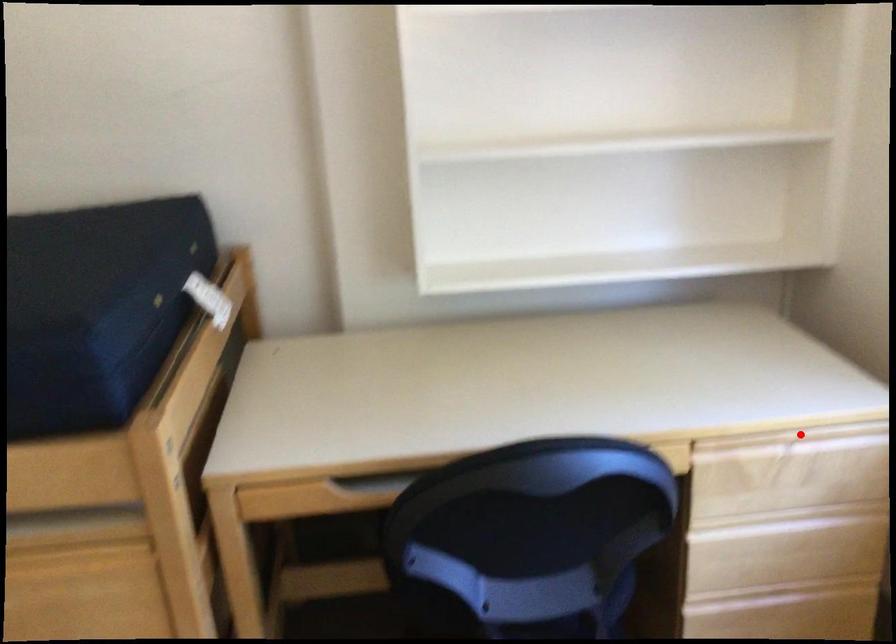
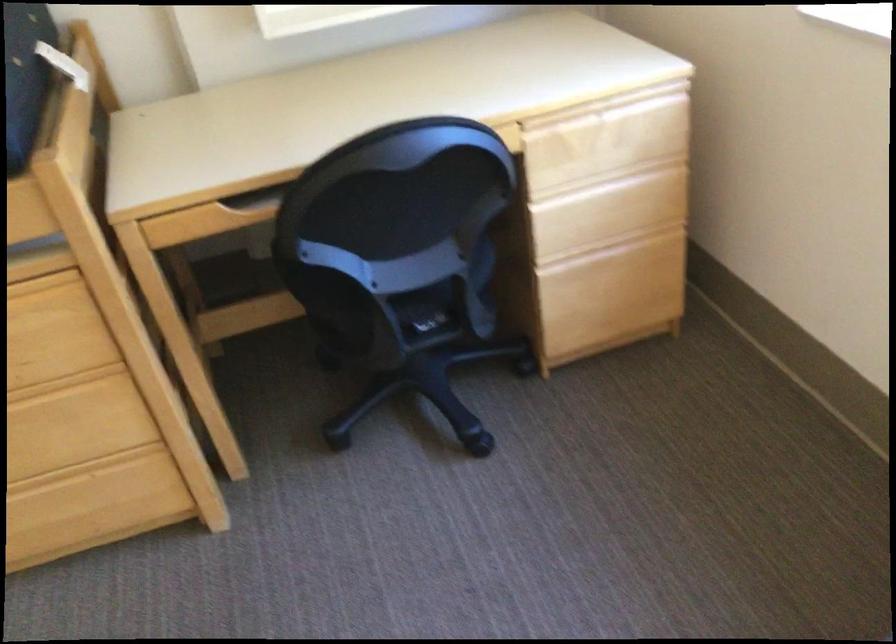
Question: I am providing you with two images of the same scene from different viewpoints. A red point is shown in image1. For the corresponding object point in image2, is it positioned nearer or farther from the camera?

Choices:
 (A) Nearer
 (B) Farther

Answer: (B)